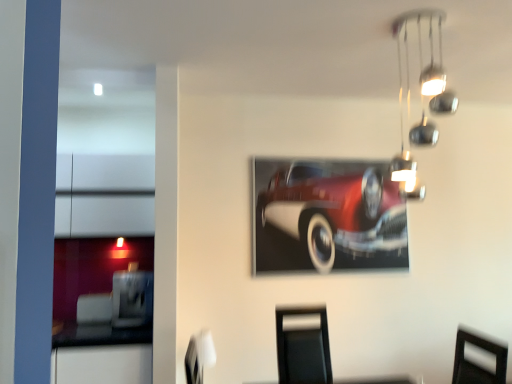
Where is `vacant area on top of chrome metallic light fixture at upper right (from a real-world perspective)`? vacant area on top of chrome metallic light fixture at upper right (from a real-world perspective) is located at coordinates (x=413, y=28).